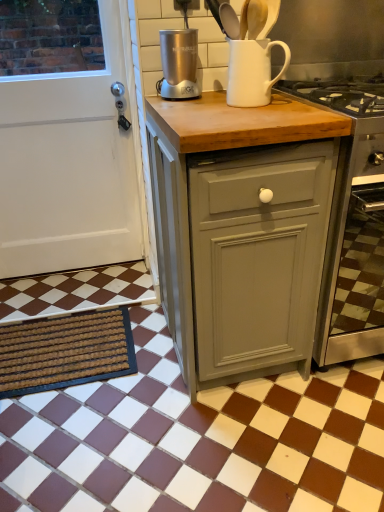
Where is `blank area to the left of white matte jug at upper center`? blank area to the left of white matte jug at upper center is located at coordinates (188, 103).